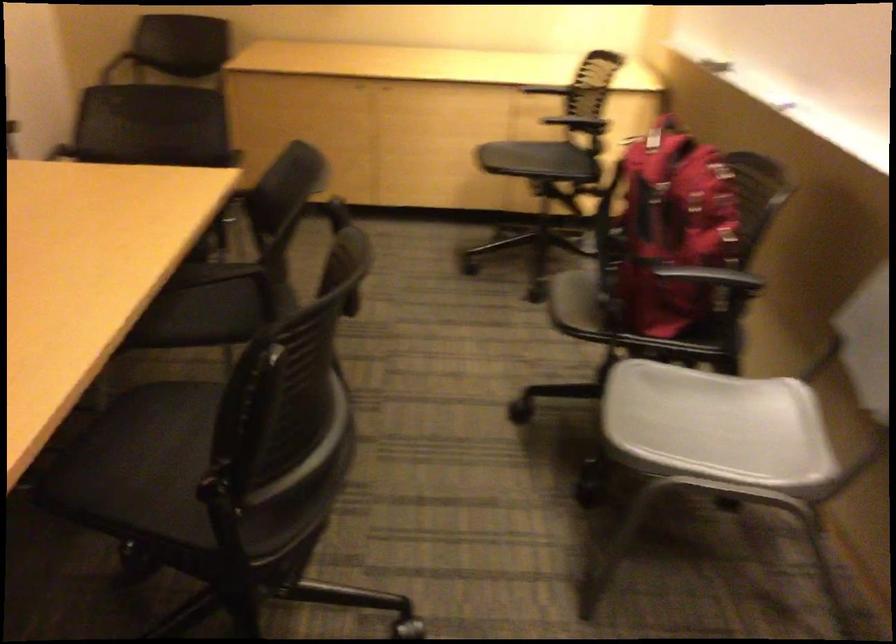
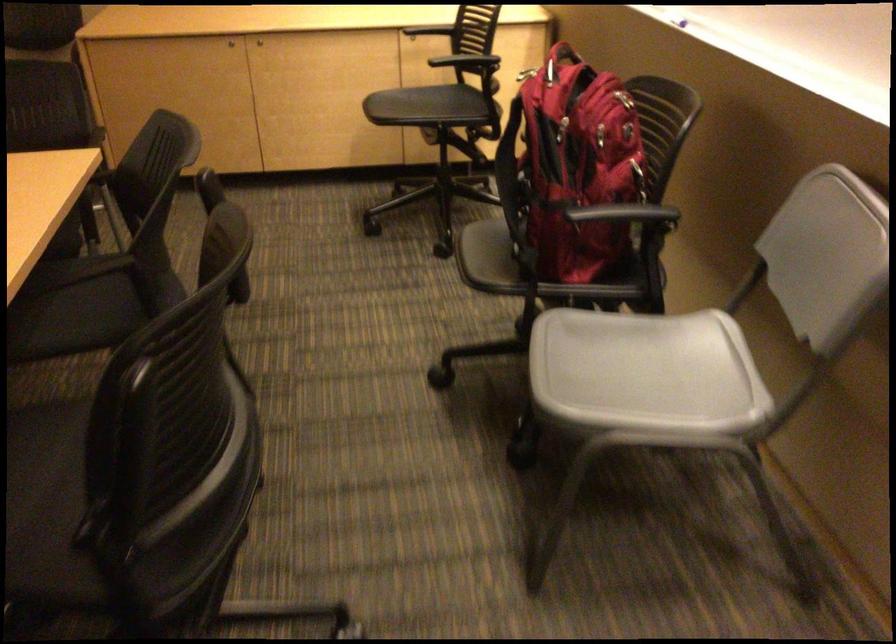
Where in the second image is the point corresponding to point 391,86 from the first image?

(259, 41)